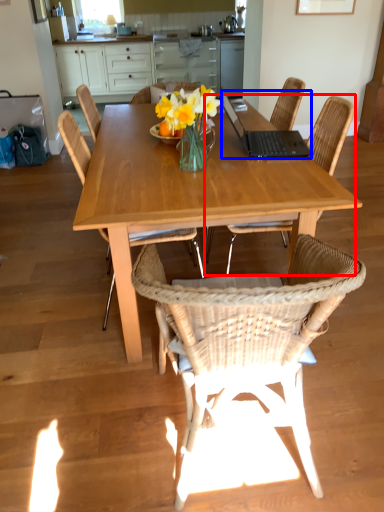
Question: Which of the following is the farthest to the observer, chair (highlighted by a red box) or laptop (highlighted by a blue box)?

Choices:
 (A) chair
 (B) laptop

Answer: (B)